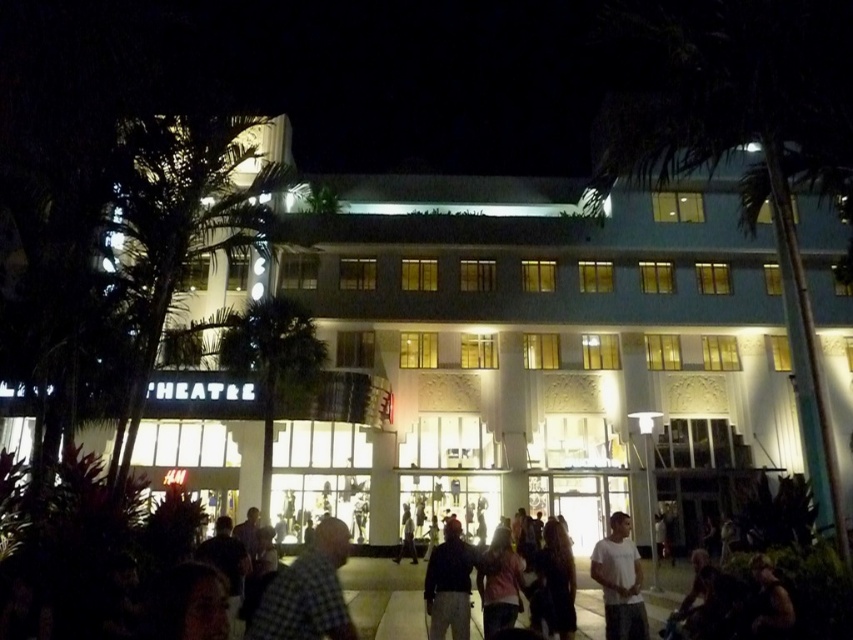
You are a photographer trying to capture a clear photo of both the dark clothing at center and the white cotton shirt at center. Since you want both subjects to be fully visible, which clothing item should you focus on first to ensure it isn t cropped out of the frame?

The dark clothing at center is taller than the white cotton shirt at center, so you should focus on capturing the dark clothing at center first to ensure its full height is visible in the photo.

You are standing at the entrance of the THEATRE building and want to find the green leafy palm tree at center. According to the coordinates provided, where should you look relative to the entrance?

The green leafy palm tree at center is located at coordinates point (273, 362), which means it is positioned to the right and slightly above the entrance.

Based on the photo, you are a photographer standing in front of the theatre. You want to take a photo of the green leafy palm tree at center and the checkered fabric shirt at center. Which object should you adjust your camera to focus on first if you want to capture both in the same frame without moving the camera?

The green leafy palm tree at center is to the left of the checkered fabric shirt at center. Since the palm tree is positioned to the left, you should focus on it first to ensure it is in the frame before capturing the shirt on the right side.